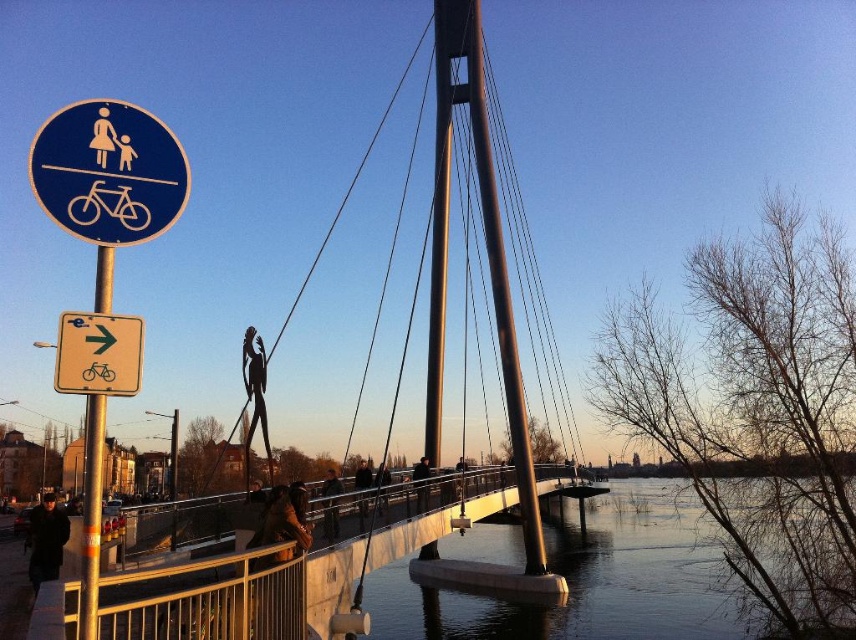
Question: Is metallic gray bridge at center smaller than metallic pole at left?

Choices:
 (A) no
 (B) yes

Answer: (B)

Question: Does metallic silver statue at center come behind dark brown leather jacket at center?

Choices:
 (A) no
 (B) yes

Answer: (A)

Question: Which object is closer to the camera taking this photo?

Choices:
 (A) yellow plastic bicycle at left
 (B) brown leather jacket at center

Answer: (A)

Question: Which point is farther to the camera?

Choices:
 (A) (302, 490)
 (B) (423, 497)
 (C) (381, 524)

Answer: (B)

Question: Which object is farther from the camera taking this photo?

Choices:
 (A) dark brown leather jacket at center
 (B) metallic pole at left
 (C) dark brown leather coat at lower left

Answer: (A)

Question: Is blue metallic sign at upper left smaller than metallic pole at left?

Choices:
 (A) yes
 (B) no

Answer: (A)